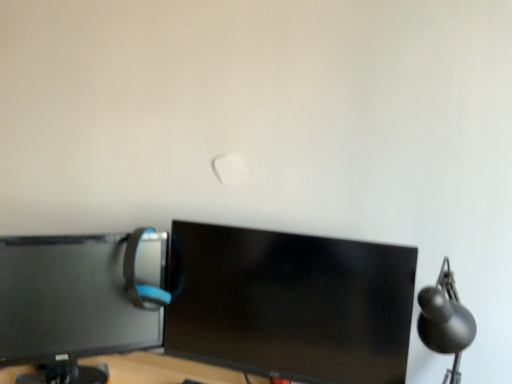
Question: Is black matte table lamp at right completely or partially inside matte black monitor at left, marked as the 2th computer monitor in a right-to-left arrangement?

Choices:
 (A) yes
 (B) no

Answer: (B)

Question: Is matte black monitor at left, the first computer monitor positioned from the left, touching black matte table lamp at right?

Choices:
 (A) yes
 (B) no

Answer: (B)

Question: Does matte black monitor at left, marked as the 2th computer monitor in a right-to-left arrangement, turn towards black matte table lamp at right?

Choices:
 (A) yes
 (B) no

Answer: (B)

Question: Are matte black monitor at left, the first computer monitor positioned from the left, and black matte table lamp at right located far from each other?

Choices:
 (A) no
 (B) yes

Answer: (A)

Question: Is matte black monitor at left, the first computer monitor positioned from the left, positioned in front of black matte table lamp at right?

Choices:
 (A) yes
 (B) no

Answer: (B)

Question: Considering the positions of point coord(462,344) and point coord(361,326), is point coord(462,344) closer or farther from the camera than point coord(361,326)?

Choices:
 (A) farther
 (B) closer

Answer: (B)

Question: Is black matte table lamp at right in front of or behind black glossy monitor at center, the first computer monitor when ordered from right to left, in the image?

Choices:
 (A) behind
 (B) front

Answer: (B)

Question: Based on their positions, is black matte table lamp at right located to the left or right of black glossy monitor at center, arranged as the second computer monitor when viewed from the left?

Choices:
 (A) left
 (B) right

Answer: (B)

Question: From their relative heights in the image, would you say black matte table lamp at right is taller or shorter than black glossy monitor at center, arranged as the second computer monitor when viewed from the left?

Choices:
 (A) tall
 (B) short

Answer: (B)

Question: From a real-world perspective, is black matte table lamp at right above or below matte gray computer chair at left?

Choices:
 (A) above
 (B) below

Answer: (B)

Question: Is black matte table lamp at right inside or outside of matte gray computer chair at left?

Choices:
 (A) inside
 (B) outside

Answer: (B)

Question: From the image's perspective, is black matte table lamp at right above or below matte gray computer chair at left?

Choices:
 (A) below
 (B) above

Answer: (A)

Question: Is black matte table lamp at right in front of or behind matte gray computer chair at left in the image?

Choices:
 (A) behind
 (B) front

Answer: (B)

Question: Is matte black monitor at left, marked as the 2th computer monitor in a right-to-left arrangement, inside or outside of matte gray computer chair at left?

Choices:
 (A) inside
 (B) outside

Answer: (B)

Question: Is matte black monitor at left, the first computer monitor positioned from the left, in front of or behind matte gray computer chair at left in the image?

Choices:
 (A) behind
 (B) front

Answer: (B)